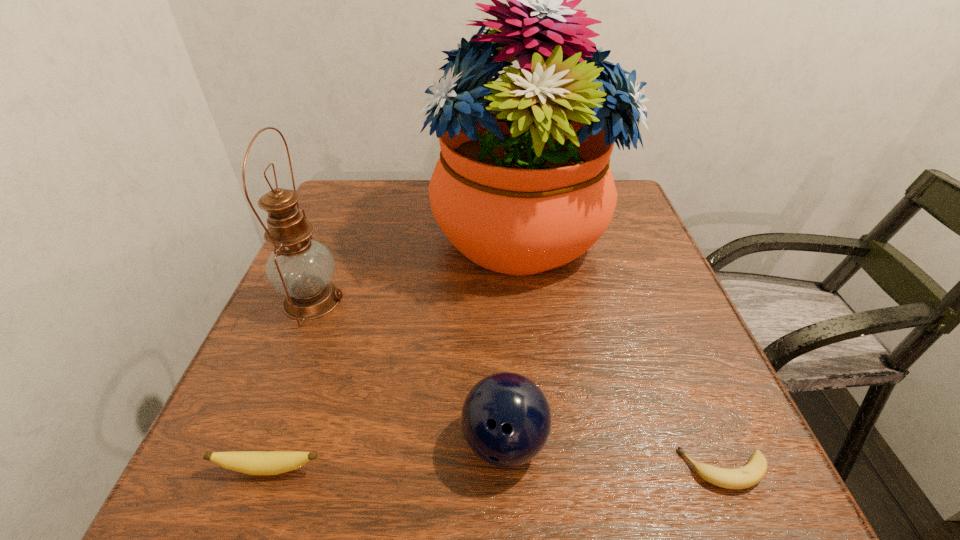
The height and width of the screenshot is (540, 960). In order to click on flower arrangement in this screenshot , I will do `click(523, 185)`.

Where is `the second tallest object`? This screenshot has height=540, width=960. the second tallest object is located at coordinates (300, 268).

Where is `the third tallest object`? the third tallest object is located at coordinates (506, 419).

This screenshot has height=540, width=960. I want to click on the left banana, so click(x=249, y=462).

At what (x,y) coordinates should I click in order to perform the action: click on the taller banana. Please return your answer as a coordinate pair (x, y). Looking at the image, I should click on (249, 462).

Where is `the shortest object`? The image size is (960, 540). the shortest object is located at coordinates (753, 472).

At what (x,y) coordinates should I click in order to perform the action: click on the shorter banana. Please return your answer as a coordinate pair (x, y). This screenshot has height=540, width=960. Looking at the image, I should click on (753, 472).

Find the location of a particular element. This screenshot has height=540, width=960. free spot located on the front of the fourth shortest object is located at coordinates pyautogui.click(x=235, y=488).

Where is `vacant space located on the right of the second shortest object`? The image size is (960, 540). vacant space located on the right of the second shortest object is located at coordinates (599, 469).

Find the location of a particular element. The height and width of the screenshot is (540, 960). vacant space located at the stem of the shorter banana is located at coordinates (468, 470).